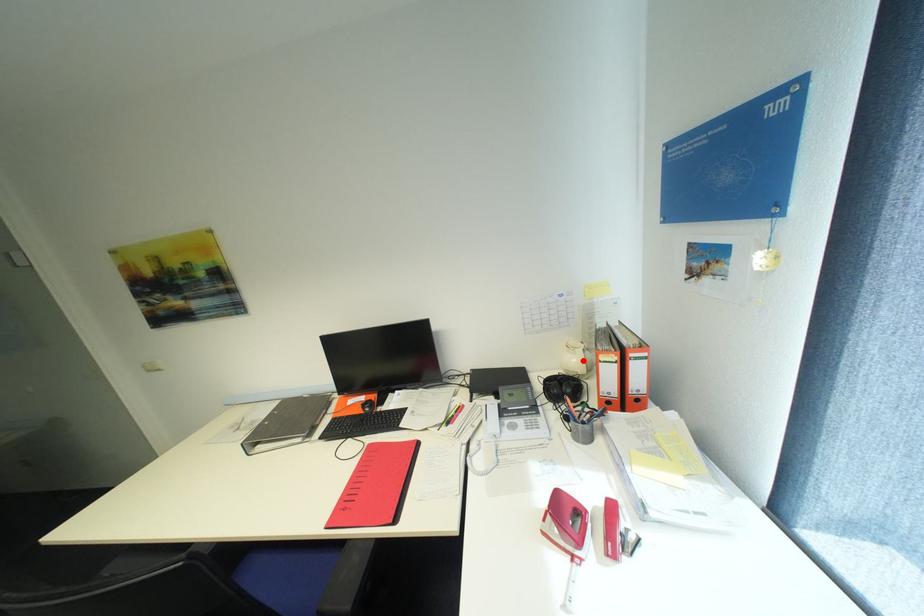
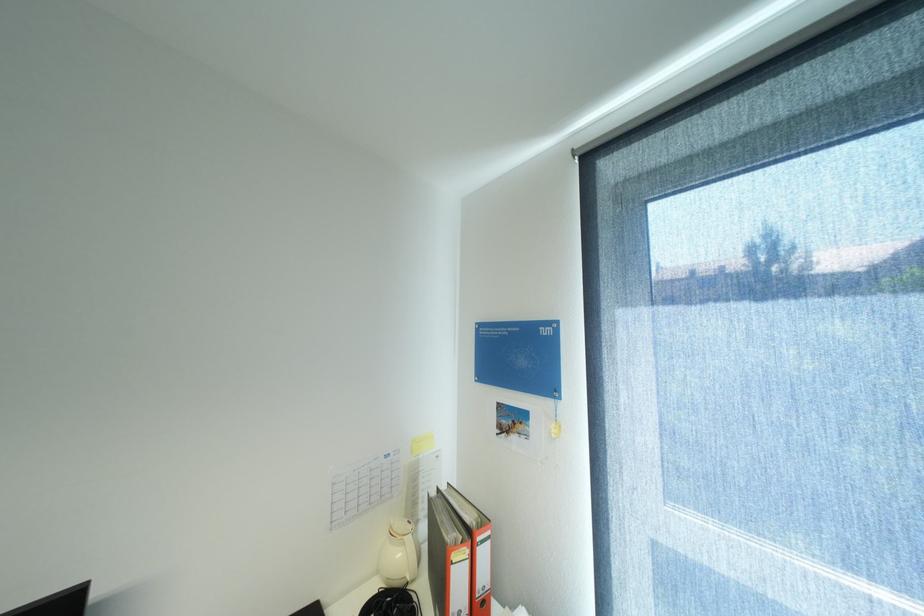
The point at the highlighted location is marked in the first image. Where is the corresponding point in the second image?

(407, 554)